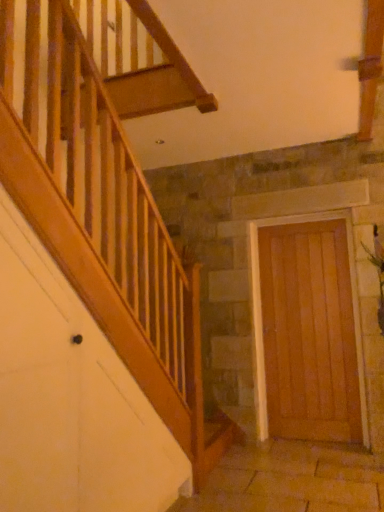
Question: Considering the positions of green leafy plant at right and wooden door at right in the image, is green leafy plant at right wider or thinner than wooden door at right?

Choices:
 (A) thin
 (B) wide

Answer: (B)

Question: From the image's perspective, is green leafy plant at right above or below wooden door at right?

Choices:
 (A) above
 (B) below

Answer: (A)

Question: Considering their positions, is green leafy plant at right located in front of or behind wooden door at right?

Choices:
 (A) front
 (B) behind

Answer: (A)

Question: Do you think wooden door at right is within green leafy plant at right, or outside of it?

Choices:
 (A) inside
 (B) outside

Answer: (B)

Question: In terms of width, does wooden door at right look wider or thinner when compared to green leafy plant at right?

Choices:
 (A) thin
 (B) wide

Answer: (A)

Question: Based on their positions, is wooden door at right located to the left or right of green leafy plant at right?

Choices:
 (A) right
 (B) left

Answer: (B)

Question: From a real-world perspective, relative to green leafy plant at right, is wooden door at right vertically above or below?

Choices:
 (A) below
 (B) above

Answer: (A)